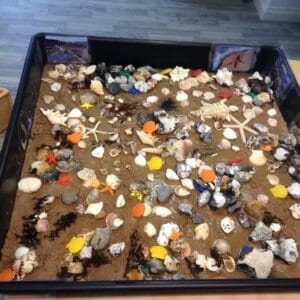
Image resolution: width=300 pixels, height=300 pixels. In order to click on edges of the tray in this screenshot , I will do `click(297, 88)`, `click(157, 41)`, `click(19, 90)`, `click(128, 284)`.